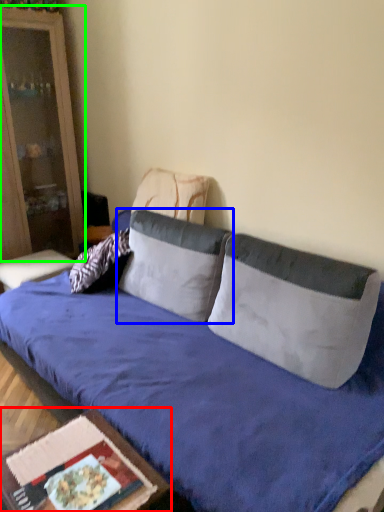
Question: Estimate the real-world distances between objects in this image. Which object is closer to table (highlighted by a red box), pillow (highlighted by a blue box) or cabinetry (highlighted by a green box)?

Choices:
 (A) pillow
 (B) cabinetry

Answer: (A)